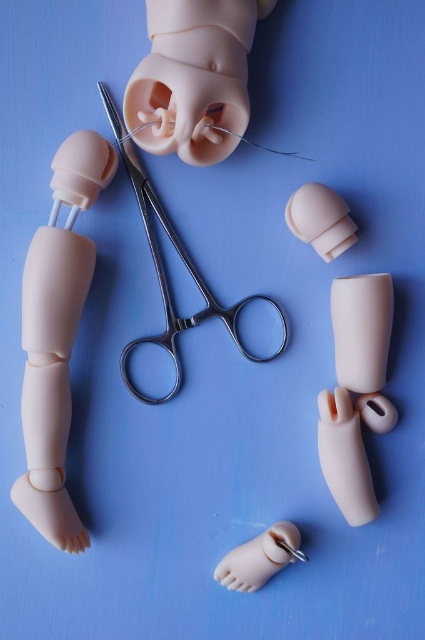
Consider the image. Is matte plastic leg at left bigger than metallic scissors at center?

Actually, matte plastic leg at left might be smaller than metallic scissors at center.

Is matte plastic leg at left below metallic scissors at center?

Correct, matte plastic leg at left is located below metallic scissors at center.

Does point (73, 541) come in front of point (172, 324)?

Yes, it is.

This screenshot has height=640, width=425. Find the location of `matte plastic leg at left`. matte plastic leg at left is located at coordinates (56, 337).

Who is positioned more to the right, metallic scissors at center or matte plastic foot at lower center?

matte plastic foot at lower center

Can you confirm if metallic scissors at center is thinner than matte plastic foot at lower center?

No.

Where is `metallic scissors at center`? The height and width of the screenshot is (640, 425). metallic scissors at center is located at coordinates (166, 276).

Is metallic scissors at center smaller than matte plastic hand at center?

Actually, metallic scissors at center might be larger than matte plastic hand at center.

What do you see at coordinates (166, 276) in the screenshot? I see `metallic scissors at center` at bounding box center [166, 276].

Between point (156, 257) and point (346, 237), which one is positioned behind?

The point (156, 257) is more distant.

The height and width of the screenshot is (640, 425). Identify the location of metallic scissors at center. (166, 276).